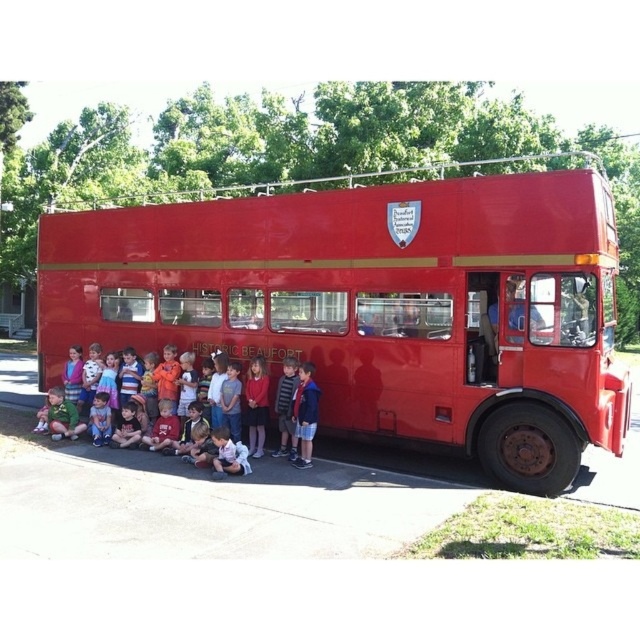
Can you confirm if shiny red bus at center is bigger than matte red shirt at lower center?

Yes.

What do you see at coordinates (376, 305) in the screenshot?
I see `shiny red bus at center` at bounding box center [376, 305].

The height and width of the screenshot is (640, 640). What do you see at coordinates (376, 305) in the screenshot?
I see `shiny red bus at center` at bounding box center [376, 305].

The image size is (640, 640). In order to click on shiny red bus at center in this screenshot , I will do `click(376, 305)`.